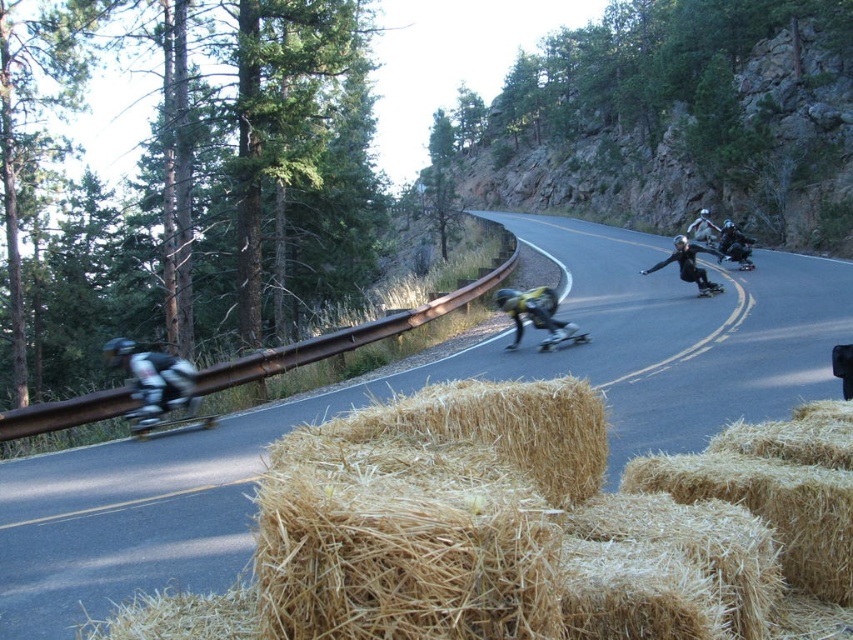
You are standing at the point marked by the coordinates (679, 337) in this downhill skateboarding scene. What object are you currently standing on?

You are standing on the asphalt road at center, as the coordinates point (679, 337) indicate that location.

You are a skateboarder preparing to jump over the asphalt road at center. The black matte skateboard at center is your target landing spot. Can you safely land on the skateboard if your jump reaches 10 feet?

The distance between the asphalt road at center and the black matte skateboard at center is 10.07 feet. Since your jump reaches 10 feet, you are 0.07 feet short, so you cannot safely land on the skateboard.

You are a skateboarder planning to ride down the winding asphalt road at center. You have a metallic silver skateboard at left. Considering the road width, will your skateboard have enough space to maneuver safely?

The asphalt road at center is wider than the metallic silver skateboard at left, so there is sufficient space for safe maneuvering.